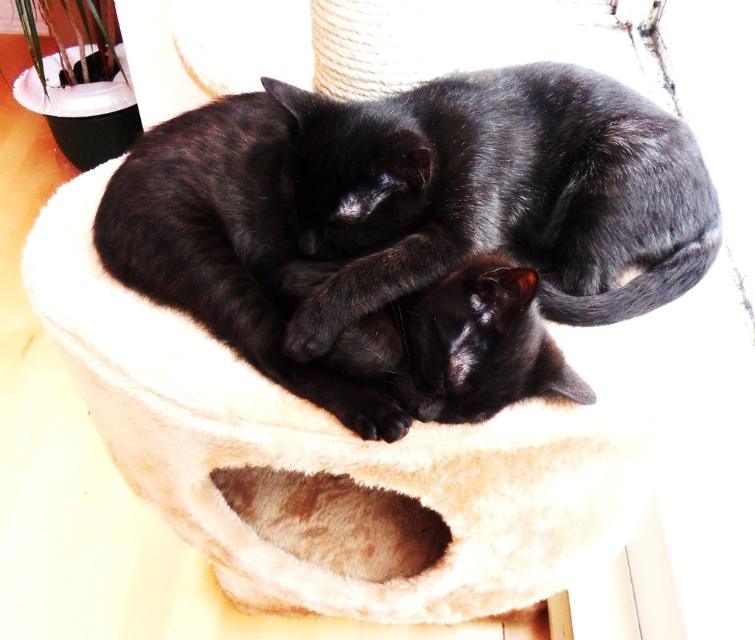
Question: Is beige plush cat bed at center behind black fur cat at center?

Choices:
 (A) no
 (B) yes

Answer: (B)

Question: Which object appears closest to the camera in this image?

Choices:
 (A) beige plush cat bed at center
 (B) black fur cat at center

Answer: (B)

Question: Can you confirm if beige plush cat bed at center is smaller than black fur cat at center?

Choices:
 (A) no
 (B) yes

Answer: (A)

Question: Can you confirm if beige plush cat bed at center is bigger than black fur cat at center?

Choices:
 (A) no
 (B) yes

Answer: (B)